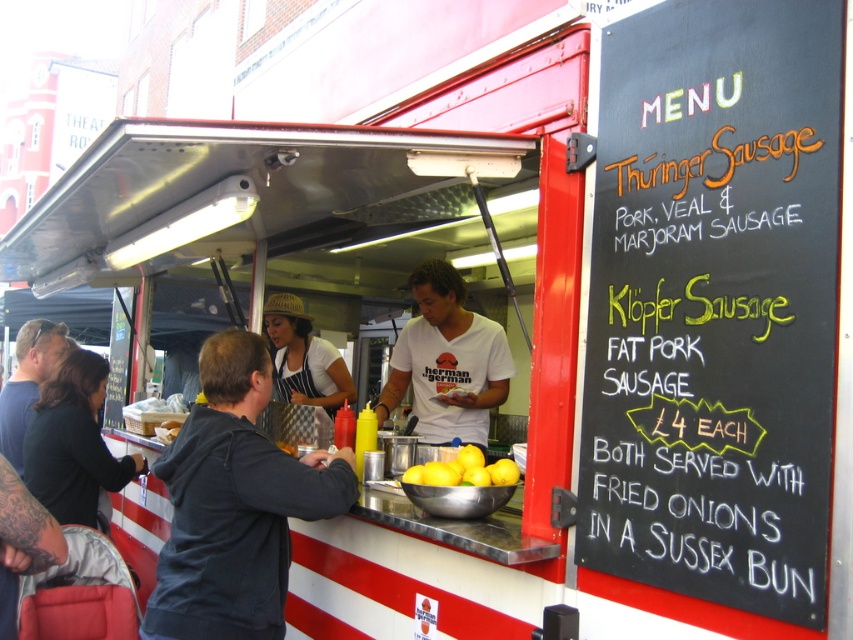
You are a customer at the food stall and want to order the Thuringer Sausage. The menu board is on your right, and there are lemons in the center. Which item is closer to you, the black chalkboard menu at right or the yellow matte lemons at center?

The black chalkboard menu at right is closer to you because it is in front of the yellow matte lemons at center.

You are a customer at the food stall and want to read the menu. Which object is closer to you, the black chalkboard menu at right or the white cotton shirt at center?

The black chalkboard menu at right is closer to you because it is in front of the white cotton shirt at center.